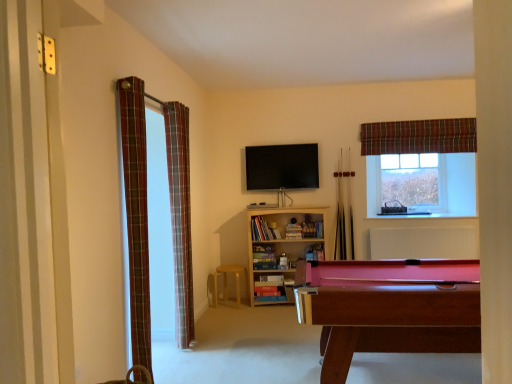
This screenshot has height=384, width=512. What do you see at coordinates (340, 215) in the screenshot?
I see `wooden pool cue at center, arranged as the 2th cue when viewed from the right` at bounding box center [340, 215].

What do you see at coordinates (390, 308) in the screenshot? I see `mahogany wood pool table at lower right` at bounding box center [390, 308].

Image resolution: width=512 pixels, height=384 pixels. In order to click on white textured radiator at center in this screenshot , I will do `click(424, 243)`.

What is the approximate height of wooden pool cue at center, the second cue from the left?

It is 4.46 feet.

This screenshot has width=512, height=384. What are the coordinates of `wooden pool cue at center, arranged as the 2th cue when viewed from the right` in the screenshot? It's located at (340, 215).

Is plaid fabric curtain at left, the second curtain in the front-to-back sequence, wider or thinner than clear glass window at upper right?

plaid fabric curtain at left, the second curtain in the front-to-back sequence, is wider than clear glass window at upper right.

Can you see plaid fabric curtain at left, which ranks as the second curtain in right-to-left order, touching clear glass window at upper right?

plaid fabric curtain at left, which ranks as the second curtain in right-to-left order, is not next to clear glass window at upper right, and they're not touching.

Between plaid fabric curtain at left, which ranks as the second curtain in right-to-left order, and clear glass window at upper right, which one has larger size?

Bigger between the two is plaid fabric curtain at left, which ranks as the second curtain in right-to-left order.

Based on the photo, is light brown wooden stool at center facing away from wooden pool cue at center, which is the 1th cue from right to left?

No, light brown wooden stool at center is not facing the opposite direction of wooden pool cue at center, which is the 1th cue from right to left.

Considering the sizes of objects light brown wooden stool at center and wooden pool cue at center, the second cue from the left, in the image provided, who is taller, light brown wooden stool at center or wooden pool cue at center, the second cue from the left,?

With more height is wooden pool cue at center, the second cue from the left.

From the image's perspective, is light brown wooden stool at center on top of wooden pool cue at center, which is the 1th cue from right to left?

No, from the image's perspective, light brown wooden stool at center is not above wooden pool cue at center, which is the 1th cue from right to left.

How different are the orientations of plaid fabric curtain at left, marked as the 1th curtain in a front-to-back arrangement, and plaid fabric curtain at upper right, which is counted as the first curtain, starting from the right, in degrees?

The angular difference between plaid fabric curtain at left, marked as the 1th curtain in a front-to-back arrangement, and plaid fabric curtain at upper right, which is counted as the first curtain, starting from the right, is 89.1 degrees.

Is plaid fabric curtain at left, the third curtain when ordered from back to front, positioned beyond the bounds of plaid fabric curtain at upper right, which ranks as the third curtain in left-to-right order?

Indeed, plaid fabric curtain at left, the third curtain when ordered from back to front, is completely outside plaid fabric curtain at upper right, which ranks as the third curtain in left-to-right order.

Can you see plaid fabric curtain at left, marked as the 1th curtain in a front-to-back arrangement, touching plaid fabric curtain at upper right, arranged as the 1th curtain when viewed from the back?

plaid fabric curtain at left, marked as the 1th curtain in a front-to-back arrangement, is not next to plaid fabric curtain at upper right, arranged as the 1th curtain when viewed from the back, and they're not touching.

Between plaid fabric curtain at left, positioned as the first curtain in left-to-right order, and plaid fabric curtain at upper right, which ranks as the third curtain in left-to-right order, which one has less height?

Standing shorter between the two is plaid fabric curtain at upper right, which ranks as the third curtain in left-to-right order.

From the image's perspective, is plaid fabric curtain at left, which ranks as the second curtain in right-to-left order, below wooden pool cue at center, which is the 1th cue from right to left?

Correct, plaid fabric curtain at left, which ranks as the second curtain in right-to-left order, appears lower than wooden pool cue at center, which is the 1th cue from right to left, in the image.

How much distance is there between plaid fabric curtain at left, acting as the 2th curtain starting from the back, and wooden pool cue at center, which is the 1th cue from right to left?

They are 6.64 feet apart.

Is plaid fabric curtain at left, the second curtain in the front-to-back sequence, not inside wooden pool cue at center, which is the 1th cue from right to left?

plaid fabric curtain at left, the second curtain in the front-to-back sequence, is positioned outside wooden pool cue at center, which is the 1th cue from right to left.

Where is `the 1st curtain positioned below the wooden pool cue at center, which is the 1th cue from right to left (from a real-world perspective)`? the 1st curtain positioned below the wooden pool cue at center, which is the 1th cue from right to left (from a real-world perspective) is located at coordinates (180, 217).

From a real-world perspective, is wooden pool cue at center, which is the 1th cue from right to left, on plaid fabric curtain at upper right, arranged as the 1th curtain when viewed from the back?

No, from a real-world perspective, wooden pool cue at center, which is the 1th cue from right to left, is not on top of plaid fabric curtain at upper right, arranged as the 1th curtain when viewed from the back.

Considering the positions of objects wooden pool cue at center, the second cue from the left, and plaid fabric curtain at upper right, acting as the third curtain starting from the front, in the image provided, who is behind, wooden pool cue at center, the second cue from the left, or plaid fabric curtain at upper right, acting as the third curtain starting from the front,?

wooden pool cue at center, the second cue from the left.

Is there a large distance between wooden pool cue at center, the second cue from the left, and plaid fabric curtain at upper right, arranged as the 1th curtain when viewed from the back?

No, there isn't a large distance between wooden pool cue at center, the second cue from the left, and plaid fabric curtain at upper right, arranged as the 1th curtain when viewed from the back.

How many degrees apart are the facing directions of light brown wooden stool at center and plaid fabric curtain at left, marked as the 2th curtain in a left-to-right arrangement?

86 degrees.

Is light brown wooden stool at center oriented away from plaid fabric curtain at left, marked as the 2th curtain in a left-to-right arrangement?

No, plaid fabric curtain at left, marked as the 2th curtain in a left-to-right arrangement, is not at the back of light brown wooden stool at center.

Considering the positions of objects light brown wooden stool at center and plaid fabric curtain at left, the second curtain in the front-to-back sequence, in the image provided, who is behind, light brown wooden stool at center or plaid fabric curtain at left, the second curtain in the front-to-back sequence,?

light brown wooden stool at center is more distant.

From a real-world perspective, which object stands above the other?

plaid fabric curtain at left, acting as the 2th curtain starting from the back, from a real-world perspective.

Choose the correct answer: Is light brown wooden stool at center inside mahogany wood pool table at lower right or outside it?

light brown wooden stool at center lies outside mahogany wood pool table at lower right.

Which of these two, light brown wooden stool at center or mahogany wood pool table at lower right, stands shorter?

light brown wooden stool at center.

Is light brown wooden stool at center beside mahogany wood pool table at lower right?

light brown wooden stool at center and mahogany wood pool table at lower right are clearly separated.

From a real-world perspective, is light brown wooden stool at center positioned above or below mahogany wood pool table at lower right?

light brown wooden stool at center is below mahogany wood pool table at lower right.

Starting from the clear glass window at upper right, which curtain is the 2nd one in front? Please provide its 2D coordinates.

[(180, 217)]

Locate an element on the screen. The image size is (512, 384). stool located below the wooden pool cue at center, the second cue from the left (from the image's perspective) is located at coordinates (226, 282).

Estimate the real-world distances between objects in this image. Which object is closer to white textured radiator at center, wooden pool cue at center, the first cue from the left, or light brown wooden stool at center?

wooden pool cue at center, the first cue from the left.

Considering their positions, is wooden pool cue at center, the first cue from the left, positioned closer to clear glass window at upper right than wooden pool cue at center, the second cue from the left?

wooden pool cue at center, the second cue from the left, is positioned closer to the anchor clear glass window at upper right.

Looking at the image, which one is located closer to wooden pool cue at center, the first cue from the left, light brown wooden stool at center or plaid fabric curtain at left, marked as the 1th curtain in a front-to-back arrangement?

The object closer to wooden pool cue at center, the first cue from the left, is light brown wooden stool at center.

From the image, which object appears to be farther from wooden bookshelf at center, plaid fabric curtain at left, which ranks as the second curtain in right-to-left order, or wooden pool cue at center, the second cue from the left?

plaid fabric curtain at left, which ranks as the second curtain in right-to-left order.

Looking at the image, which one is located further to white textured radiator at center, mahogany wood pool table at lower right or plaid fabric curtain at left, which ranks as the second curtain in right-to-left order?

plaid fabric curtain at left, which ranks as the second curtain in right-to-left order, lies further to white textured radiator at center than the other object.

From the image, which object appears to be farther from mahogany wood pool table at lower right, light brown wooden stool at center or white textured radiator at center?

A: light brown wooden stool at center is further to mahogany wood pool table at lower right.

Looking at the image, which one is located closer to plaid fabric curtain at left, the third curtain in the right-to-left sequence, plaid fabric curtain at upper right, which is counted as the first curtain, starting from the right, or wooden pool cue at center, the first cue from the left?

The object closer to plaid fabric curtain at left, the third curtain in the right-to-left sequence, is wooden pool cue at center, the first cue from the left.

From the image, which object appears to be nearer to wooden pool cue at center, arranged as the 2th cue when viewed from the right, light brown wooden stool at center or white textured radiator at center?

Based on the image, white textured radiator at center appears to be nearer to wooden pool cue at center, arranged as the 2th cue when viewed from the right.

I want to click on bookcase between plaid fabric curtain at left, positioned as the first curtain in left-to-right order, and wooden pool cue at center, which is the 1th cue from right to left, from front to back, so click(281, 250).

The height and width of the screenshot is (384, 512). Find the location of `stool between plaid fabric curtain at left, the third curtain when ordered from back to front, and white textured radiator at center from left to right`. stool between plaid fabric curtain at left, the third curtain when ordered from back to front, and white textured radiator at center from left to right is located at coordinates pos(226,282).

This screenshot has width=512, height=384. What are the coordinates of `radiator located between mahogany wood pool table at lower right and plaid fabric curtain at upper right, which is counted as the first curtain, starting from the right, in the depth direction` in the screenshot? It's located at (424, 243).

Find the location of a particular element. The height and width of the screenshot is (384, 512). radiator situated between wooden pool cue at center, arranged as the 2th cue when viewed from the right, and clear glass window at upper right from left to right is located at coordinates (424, 243).